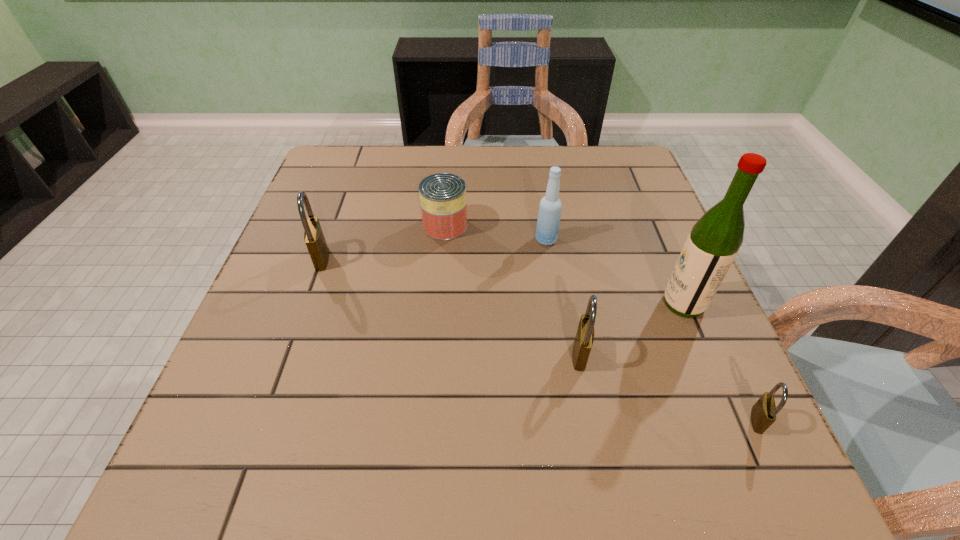
If we want them evenly spaced by inserting an extra padlock among them, please locate a free spot for this new padlock. Please provide its 2D coordinates. Your answer should be formatted as a tuple, i.e. [(x, y)], where the tuple contains the x and y coordinates of a point satisfying the conditions above.

[(438, 301)]